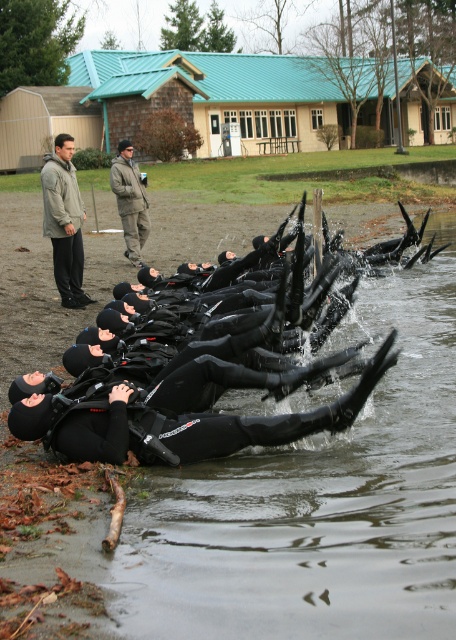
Is gray woolen jacket at left behind khaki wool jacket at upper center?

No, it is in front of khaki wool jacket at upper center.

Which is more to the right, gray woolen jacket at left or khaki wool jacket at upper center?

khaki wool jacket at upper center

Is point (48, 170) behind point (128, 160)?

No, (48, 170) is in front of (128, 160).

The image size is (456, 640). What are the coordinates of `gray woolen jacket at left` in the screenshot? It's located at (63, 221).

Can you confirm if black matte wetsuit at lower center is wider than gray woolen jacket at left?

Indeed, black matte wetsuit at lower center has a greater width compared to gray woolen jacket at left.

Where is `black matte wetsuit at lower center`? This screenshot has height=640, width=456. black matte wetsuit at lower center is located at coordinates (316, 508).

Which is in front, point (202, 586) or point (43, 157)?

Point (202, 586)

Identify the location of black matte wetsuit at lower center. The image size is (456, 640). (316, 508).

Who is more forward, (135, 452) or (141, 204)?

Point (135, 452)

Who is positioned more to the left, black matte wetsuit at center or khaki wool jacket at upper center?

khaki wool jacket at upper center

Which is in front, point (267, 429) or point (115, 156)?

Point (267, 429)

Where is `black matte wetsuit at center`? The width and height of the screenshot is (456, 640). black matte wetsuit at center is located at coordinates (205, 416).